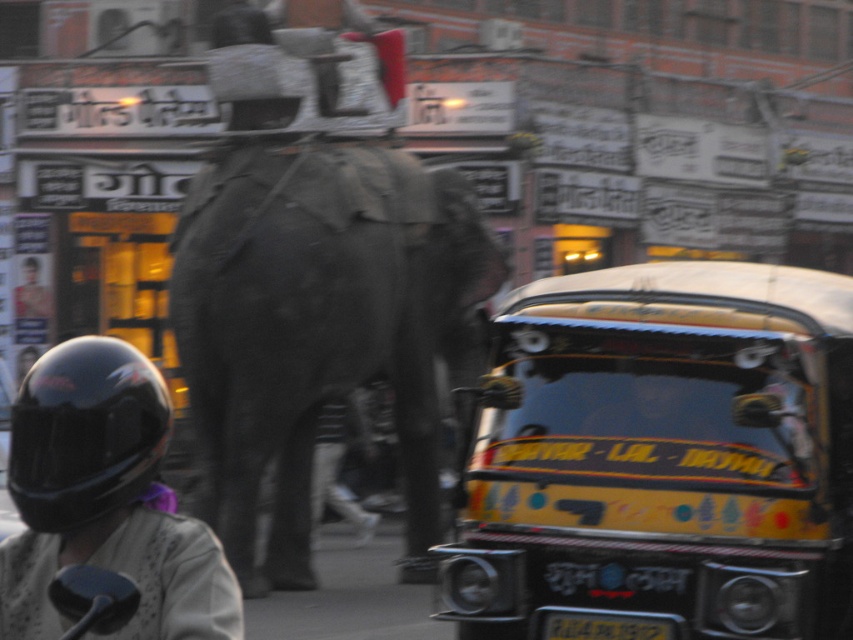
You are a pedestrian standing on the sidewalk and see the gray textured elephant at center and the black plastic license plate at center in the street. Which object is closer to your left side?

The gray textured elephant at center is closer to your left side because it is positioned to the left of the black plastic license plate at center.

You are a pedestrian standing on the sidewalk and see the black matte helmet at lower left and the black plastic license plate at center. Which object is closer to you?

The black matte helmet at lower left is closer to you because it is in front of the black plastic license plate at center.